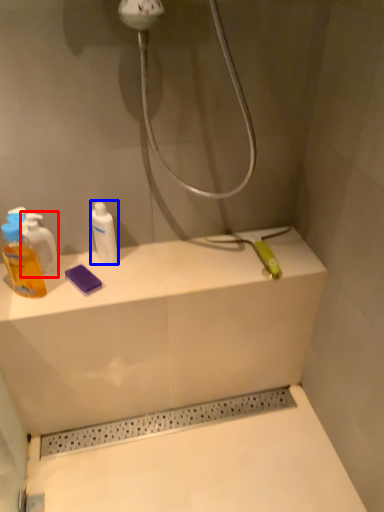
Question: Which object appears closest to the camera in this image, mouthwash (highlighted by a red box) or mouthwash (highlighted by a blue box)?

Choices:
 (A) mouthwash
 (B) mouthwash

Answer: (A)